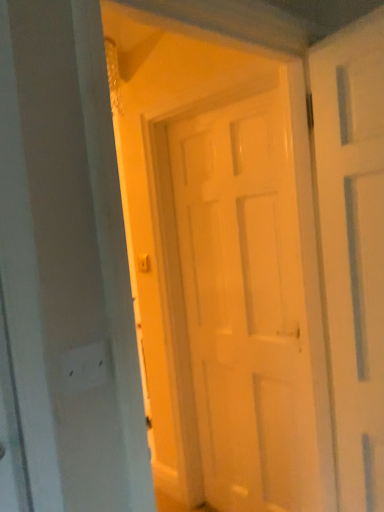
Question: Which is correct: white matte door at center is inside white matte electric outlet at lower left, or outside of it?

Choices:
 (A) outside
 (B) inside

Answer: (A)

Question: Is point (145, 110) positioned closer to the camera than point (74, 381)?

Choices:
 (A) farther
 (B) closer

Answer: (A)

Question: Considering the positions of white matte door at center and white matte electric outlet at lower left in the image, is white matte door at center wider or thinner than white matte electric outlet at lower left?

Choices:
 (A) wide
 (B) thin

Answer: (A)

Question: From a real-world perspective, is white matte electric outlet at lower left physically located above or below white matte door at center?

Choices:
 (A) above
 (B) below

Answer: (A)

Question: In terms of height, does white matte electric outlet at lower left look taller or shorter compared to white matte door at center?

Choices:
 (A) tall
 (B) short

Answer: (B)

Question: Looking at the image, does white matte electric outlet at lower left seem bigger or smaller compared to white matte door at center?

Choices:
 (A) small
 (B) big

Answer: (A)

Question: Relative to white matte door at center, is white matte electric outlet at lower left in front or behind?

Choices:
 (A) front
 (B) behind

Answer: (A)